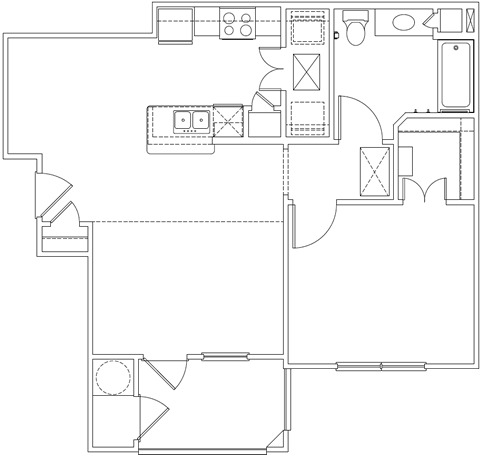
Image resolution: width=483 pixels, height=455 pixels. What are the coordinates of `oven` in the screenshot? It's located at (228, 33), (227, 14), (245, 15), (250, 32).